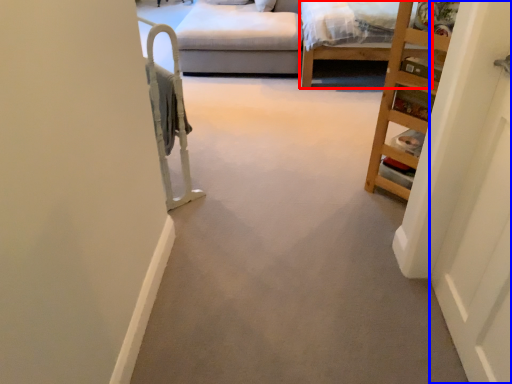
Question: Which of the following is the farthest to the observer, bed frame (highlighted by a red box) or door (highlighted by a blue box)?

Choices:
 (A) bed frame
 (B) door

Answer: (A)